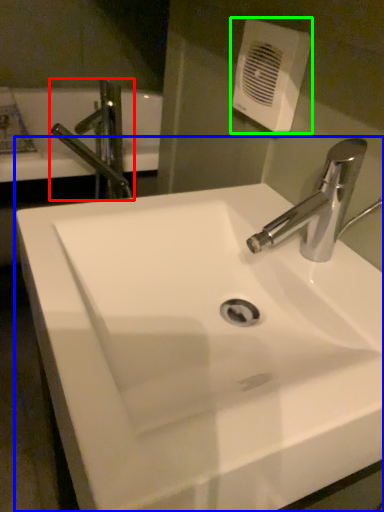
Question: Which object is the closest to the tap (highlighted by a red box)? Choose among these: sink (highlighted by a blue box) or hand dryer (highlighted by a green box).

Choices:
 (A) sink
 (B) hand dryer

Answer: (B)